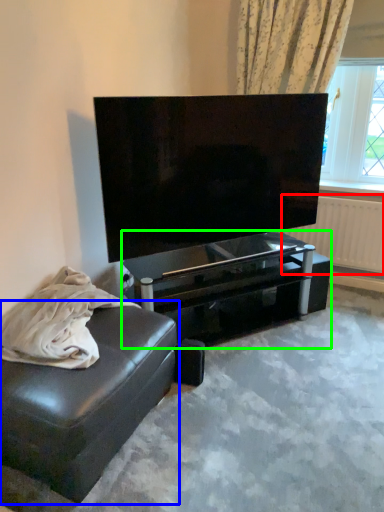
Question: Estimate the real-world distances between objects in this image. Which object is farther from radiator (highlighted by a red box), studio couch (highlighted by a blue box) or table (highlighted by a green box)?

Choices:
 (A) studio couch
 (B) table

Answer: (A)